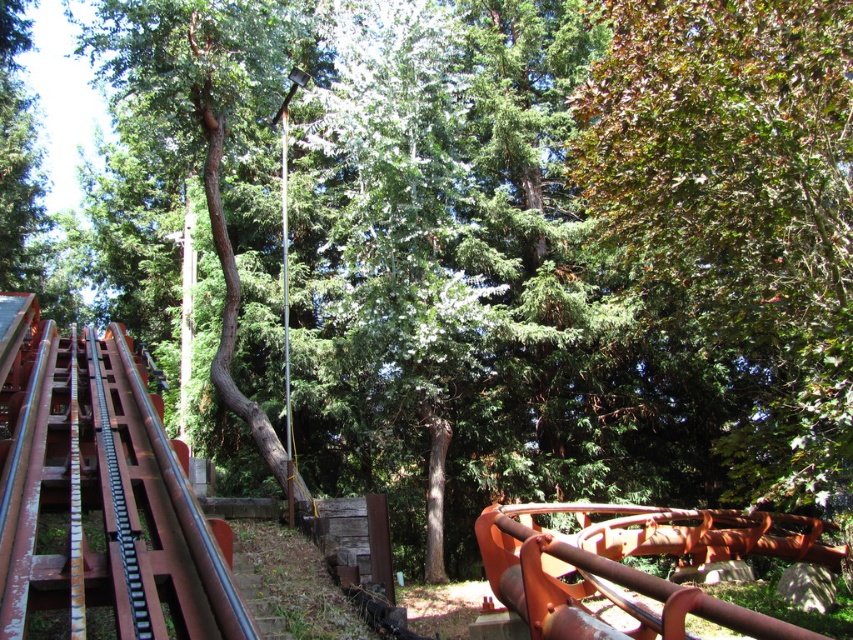
The height and width of the screenshot is (640, 853). Identify the location of green leafy tree at upper right. (740, 209).

Who is more distant from viewer, [833,355] or [657,624]?

Point [833,355]

Identify the location of green leafy tree at upper right. (740, 209).

Who is lower down, rusty metal train track at left or green rough bark tree at center?

rusty metal train track at left is below.

Where is `rusty metal train track at left`? The image size is (853, 640). rusty metal train track at left is located at coordinates (97, 496).

Does green leafy tree at upper right have a greater width compared to rusty metal train track at left?

Correct, the width of green leafy tree at upper right exceeds that of rusty metal train track at left.

Is green leafy tree at upper right to the right of rusty metal train track at left from the viewer's perspective?

Indeed, green leafy tree at upper right is positioned on the right side of rusty metal train track at left.

The width and height of the screenshot is (853, 640). Describe the element at coordinates (740, 209) in the screenshot. I see `green leafy tree at upper right` at that location.

This screenshot has width=853, height=640. What are the coordinates of `green leafy tree at upper right` in the screenshot? It's located at (740, 209).